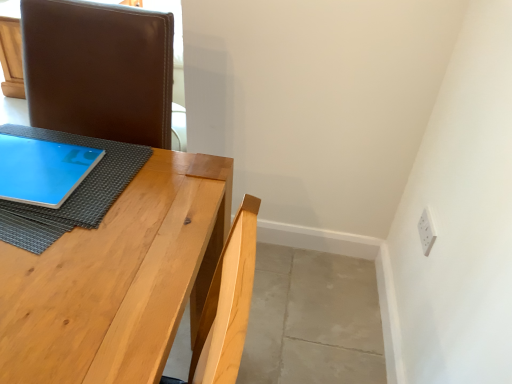
Question: From the image's perspective, does blue fabric at upper left appear higher than matte blue tablet at left?

Choices:
 (A) yes
 (B) no

Answer: (B)

Question: Is the position of blue fabric at upper left less distant than that of matte blue tablet at left?

Choices:
 (A) yes
 (B) no

Answer: (A)

Question: Is blue fabric at upper left far from matte blue tablet at left?

Choices:
 (A) no
 (B) yes

Answer: (A)

Question: From the image's perspective, is blue fabric at upper left located beneath matte blue tablet at left?

Choices:
 (A) no
 (B) yes

Answer: (B)

Question: Does blue fabric at upper left have a greater width compared to matte blue tablet at left?

Choices:
 (A) no
 (B) yes

Answer: (B)

Question: Would you say blue fabric at upper left contains matte blue tablet at left?

Choices:
 (A) no
 (B) yes

Answer: (A)

Question: Is natural wood table at center far from blue fabric at upper left?

Choices:
 (A) yes
 (B) no

Answer: (B)

Question: Does natural wood table at center lie behind blue fabric at upper left?

Choices:
 (A) no
 (B) yes

Answer: (A)

Question: From the image's perspective, is natural wood table at center over blue fabric at upper left?

Choices:
 (A) no
 (B) yes

Answer: (A)

Question: Is natural wood table at center not within blue fabric at upper left?

Choices:
 (A) no
 (B) yes

Answer: (B)

Question: Is natural wood table at center in contact with blue fabric at upper left?

Choices:
 (A) yes
 (B) no

Answer: (A)

Question: From a real-world perspective, does natural wood table at center stand above blue fabric at upper left?

Choices:
 (A) no
 (B) yes

Answer: (A)

Question: Does matte blue tablet at left contain natural wood table at center?

Choices:
 (A) no
 (B) yes

Answer: (A)